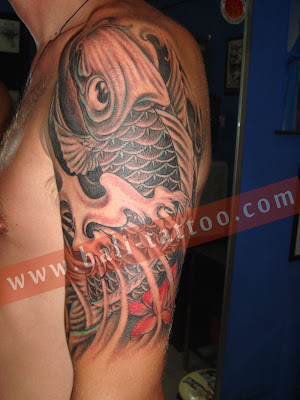
I want to click on picture, so click(228, 67).